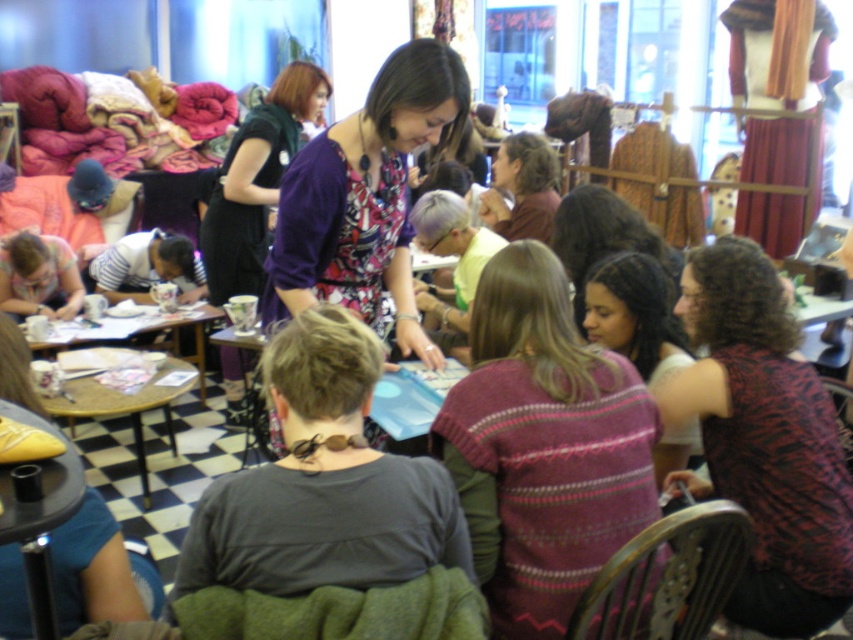
Question: Does matte pink sweater at lower left have a larger size compared to wooden table at lower left?

Choices:
 (A) yes
 (B) no

Answer: (B)

Question: Which point appears farthest from the camera in this image?

Choices:
 (A) (537, 296)
 (B) (514, 148)
 (C) (138, 428)

Answer: (B)

Question: Can you confirm if matte pink sweater at lower left is thinner than wooden table at lower left?

Choices:
 (A) no
 (B) yes

Answer: (B)

Question: Which object appears farthest from the camera in this image?

Choices:
 (A) knitted sweater at center
 (B) wooden table at center

Answer: (B)

Question: Estimate the real-world distances between objects in this image. Which object is farther from the matte pink sweater at lower left?

Choices:
 (A) striped sweater at center
 (B) purple dress at center

Answer: (A)

Question: Does striped sweater at center appear over wooden table at lower left?

Choices:
 (A) no
 (B) yes

Answer: (B)